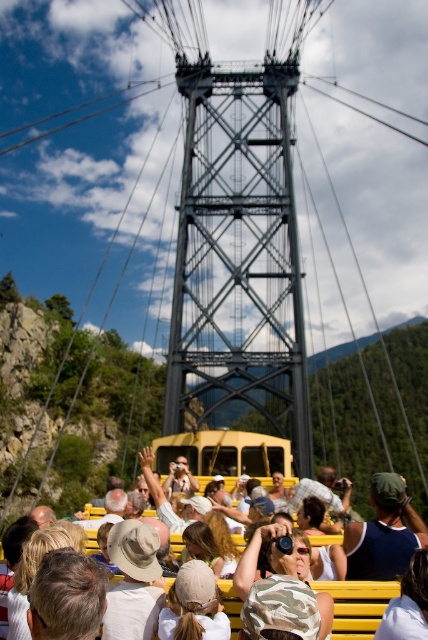
Question: From the image, what is the correct spatial relationship of light brown hair at center in relation to camouflage hat at center?

Choices:
 (A) right
 (B) left

Answer: (B)

Question: Is light brown hair at center to the right of camo fabric shirt at center from the viewer's perspective?

Choices:
 (A) no
 (B) yes

Answer: (A)

Question: Which object is positioned closest to the camouflage hat at center?

Choices:
 (A) camo fabric shirt at center
 (B) light brown hair at center

Answer: (A)

Question: Is metallic gray bridge at center smaller than white cotton cap at center?

Choices:
 (A) yes
 (B) no

Answer: (B)

Question: Which object is positioned farthest from the light brown hair at center?

Choices:
 (A) camo fabric shirt at center
 (B) yellow plastic bench at lower center
 (C) white cotton cap at center
 (D) camouflage hat at center

Answer: (C)

Question: Which object is farther from the camera taking this photo?

Choices:
 (A) light brown hair at center
 (B) camouflage hat at center
 (C) camo fabric shirt at center
 (D) metallic gray bridge at center

Answer: (D)